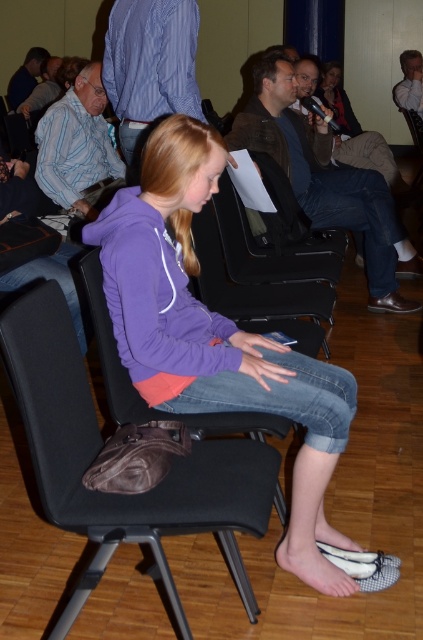
You are standing at the point marked as point [148,241] and want to walk to the point marked as point [43,464]. Which direction should you move in?

To move from point [148,241] to point [43,464], you should move forward since point [148,241] is behind point [43,464].

You are organizing a seating arrangement for a small workshop. The purple fleece jacket at center and the black fabric chair at center are in the same row. If the total space allocated for this row is 1.8 meters, can both items fit side by side without overlapping?

The purple fleece jacket at center is wider than the black fabric chair at center. Since the jacket is already wider than the chair, and the total space is 1.8 meters, it depends on their combined widths. However, since the jacket alone might exceed half the space, they might not fit. But without exact measurements, we can only say that the jacket is wider, so it requires more space. If the jacket takes more than 0.9 meters, they won